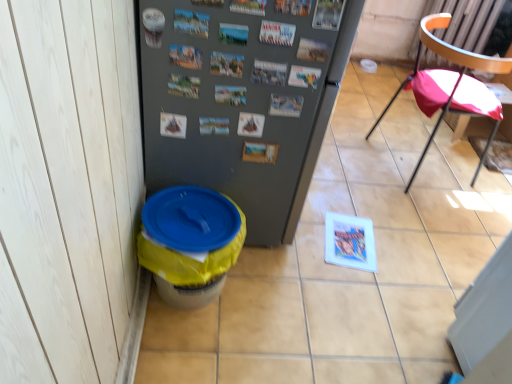
Describe the element at coordinates (243, 99) in the screenshot. I see `gray matte refrigerator at center` at that location.

Locate an element on the screen. yellow plastic trash can at lower left is located at coordinates [348, 268].

The height and width of the screenshot is (384, 512). In order to click on yellow plastic potty at lower left in this screenshot , I will do `click(190, 243)`.

Consider the image. Considering the sizes of objects yellow plastic trash can at lower left and pink fabric chair at right in the image provided, who is bigger, yellow plastic trash can at lower left or pink fabric chair at right?

With larger size is yellow plastic trash can at lower left.

From the image's perspective, would you say yellow plastic trash can at lower left is shown under pink fabric chair at right?

Yes, from the image's perspective, yellow plastic trash can at lower left is below pink fabric chair at right.

From a real-world perspective, is yellow plastic trash can at lower left over pink fabric chair at right?

No.

Between yellow plastic trash can at lower left and pink fabric chair at right, which one has more height?

pink fabric chair at right is taller.

Locate an element on the screen. The height and width of the screenshot is (384, 512). tile behind the yellow plastic potty at lower left is located at coordinates (348, 268).

Could you tell me if yellow plastic potty at lower left is facing yellow plastic trash can at lower left?

No, yellow plastic potty at lower left is not facing towards yellow plastic trash can at lower left.

Which of these two, yellow plastic potty at lower left or yellow plastic trash can at lower left, is bigger?

With larger size is yellow plastic trash can at lower left.

Is yellow plastic potty at lower left touching yellow plastic trash can at lower left?

yellow plastic potty at lower left is not next to yellow plastic trash can at lower left, and they're not touching.

Where is `tile behind the gray matte refrigerator at center`? tile behind the gray matte refrigerator at center is located at coordinates (348, 268).

Which point is more distant from viewer, (267, 95) or (157, 333)?

The point (157, 333) is farther from the camera.

Does gray matte refrigerator at center come behind yellow plastic trash can at lower left?

No, it is not.

Considering the relative positions of gray matte refrigerator at center and yellow plastic trash can at lower left in the image provided, is gray matte refrigerator at center to the left or to the right of yellow plastic trash can at lower left?

From the image, it's evident that gray matte refrigerator at center is to the left of yellow plastic trash can at lower left.

Between point (467, 100) and point (179, 256), which one is positioned in front?

The point (179, 256) is more forward.

Between pink fabric chair at right and yellow plastic potty at lower left, which one appears on the left side from the viewer's perspective?

From the viewer's perspective, yellow plastic potty at lower left appears more on the left side.

Measure the distance from pink fabric chair at right to yellow plastic potty at lower left.

They are 1.26 meters apart.

How many degrees apart are the facing directions of pink fabric chair at right and yellow plastic potty at lower left?

12.2 degrees separate the facing orientations of pink fabric chair at right and yellow plastic potty at lower left.

From the image's perspective, which one is positioned higher, yellow plastic potty at lower left or gray matte refrigerator at center?

From the image's view, gray matte refrigerator at center is above.

This screenshot has height=384, width=512. Find the location of `potty behind the gray matte refrigerator at center`. potty behind the gray matte refrigerator at center is located at coordinates (190, 243).

Considering the sizes of objects yellow plastic potty at lower left and gray matte refrigerator at center in the image provided, who is wider, yellow plastic potty at lower left or gray matte refrigerator at center?

gray matte refrigerator at center.

Does yellow plastic potty at lower left appear on the right side of gray matte refrigerator at center?

Incorrect, yellow plastic potty at lower left is not on the right side of gray matte refrigerator at center.

Identify the location of refrigerator above the pink fabric chair at right (from a real-world perspective). (243, 99).

In the image, is pink fabric chair at right positioned in front of or behind gray matte refrigerator at center?

Visually, pink fabric chair at right is located behind gray matte refrigerator at center.

How different are the orientations of pink fabric chair at right and gray matte refrigerator at center in degrees?

There is a 11.5-degree angle between the facing directions of pink fabric chair at right and gray matte refrigerator at center.

Considering the relative sizes of pink fabric chair at right and gray matte refrigerator at center in the image provided, is pink fabric chair at right bigger than gray matte refrigerator at center?

No.

Is point (244, 373) farther from viewer compared to point (154, 264)?

Yes, it is.

Identify the location of potty above the yellow plastic trash can at lower left (from a real-world perspective). This screenshot has width=512, height=384. (190, 243).

Can you confirm if yellow plastic trash can at lower left is thinner than yellow plastic potty at lower left?

In fact, yellow plastic trash can at lower left might be wider than yellow plastic potty at lower left.

Identify the location of tile that appears below the pink fabric chair at right (from a real-world perspective). The height and width of the screenshot is (384, 512). (348, 268).

Identify the location of potty on the left of yellow plastic trash can at lower left. Image resolution: width=512 pixels, height=384 pixels. (190, 243).

Considering their positions, is yellow plastic trash can at lower left positioned closer to gray matte refrigerator at center than pink fabric chair at right?

yellow plastic trash can at lower left is closer to gray matte refrigerator at center.

When comparing their distances from gray matte refrigerator at center, does yellow plastic trash can at lower left or yellow plastic potty at lower left seem further?

Among the two, yellow plastic trash can at lower left is located further to gray matte refrigerator at center.

Which object lies nearer to the anchor point yellow plastic trash can at lower left, pink fabric chair at right or gray matte refrigerator at center?

pink fabric chair at right is closer to yellow plastic trash can at lower left.

Considering their positions, is gray matte refrigerator at center positioned further to yellow plastic trash can at lower left than yellow plastic potty at lower left?

gray matte refrigerator at center is positioned further to the anchor yellow plastic trash can at lower left.

Estimate the real-world distances between objects in this image. Which object is further from yellow plastic potty at lower left, yellow plastic trash can at lower left or gray matte refrigerator at center?

yellow plastic trash can at lower left lies further to yellow plastic potty at lower left than the other object.

Based on their spatial positions, is yellow plastic trash can at lower left or pink fabric chair at right further from yellow plastic potty at lower left?

pink fabric chair at right.

Looking at the image, which one is located further to yellow plastic trash can at lower left, pink fabric chair at right or yellow plastic potty at lower left?

Among the two, pink fabric chair at right is located further to yellow plastic trash can at lower left.

From the picture: Based on their spatial positions, is pink fabric chair at right or yellow plastic trash can at lower left further from yellow plastic potty at lower left?

pink fabric chair at right is positioned further to the anchor yellow plastic potty at lower left.

Locate an element on the screen. tile located between yellow plastic potty at lower left and pink fabric chair at right in the left-right direction is located at coordinates (348, 268).

I want to click on tile located between gray matte refrigerator at center and pink fabric chair at right in the left-right direction, so click(x=348, y=268).

Where is `refrigerator situated between yellow plastic potty at lower left and pink fabric chair at right from left to right`? This screenshot has height=384, width=512. refrigerator situated between yellow plastic potty at lower left and pink fabric chair at right from left to right is located at coordinates (243, 99).

Identify the location of refrigerator between yellow plastic potty at lower left and yellow plastic trash can at lower left in the horizontal direction. This screenshot has width=512, height=384. (243, 99).